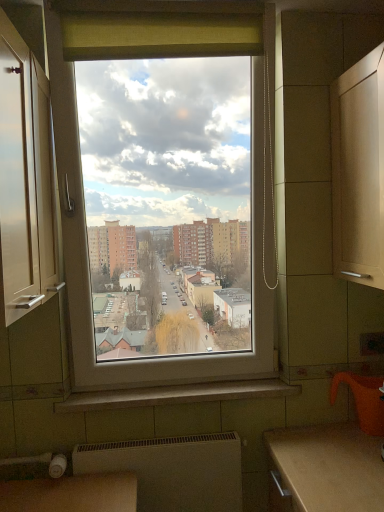
You are a GUI agent. You are given a task and a screenshot of the screen. Output one action in this format:
    pyautogui.click(x=<x>, y=<y>)
    Task: Click on the free location above white glossy window sill at center (from a real-world perspective)
    The width and height of the screenshot is (384, 512).
    Given the screenshot: What is the action you would take?
    pyautogui.click(x=178, y=376)